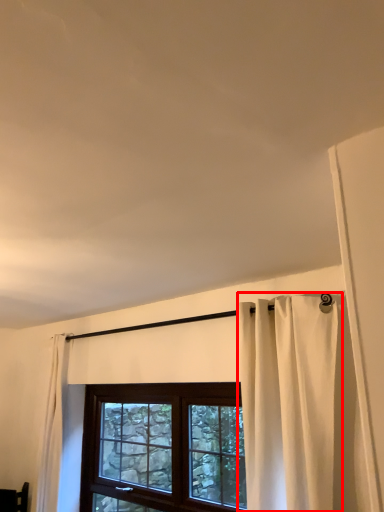
Question: From the image's perspective, where is curtain (annotated by the red box) located relative to window?

Choices:
 (A) below
 (B) above

Answer: (B)